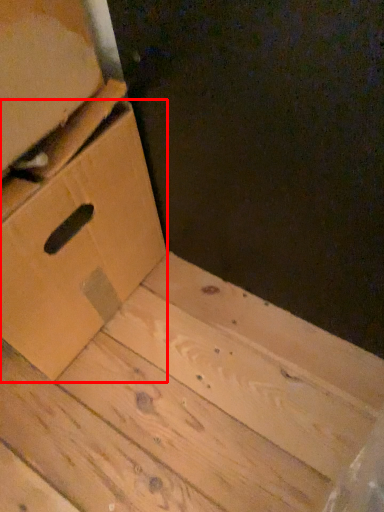
Question: In this image, where is drawer (annotated by the red box) located relative to cardboard box?

Choices:
 (A) right
 (B) left

Answer: (B)